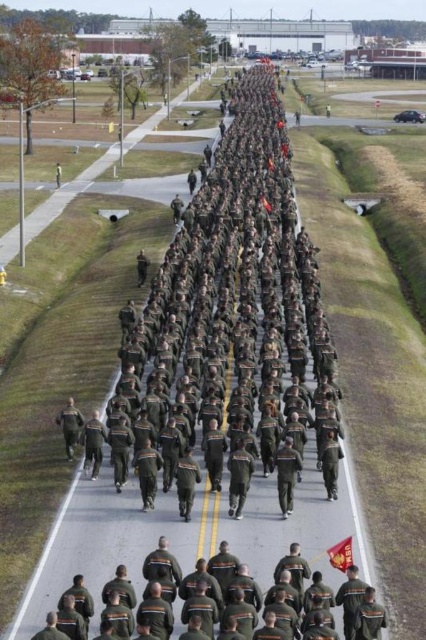
Question: Does dark green uniform at lower right appear on the right side of red fabric flag at center?

Choices:
 (A) yes
 (B) no

Answer: (B)

Question: Does dark green uniform at lower right appear under red fabric flag at center?

Choices:
 (A) yes
 (B) no

Answer: (A)

Question: Which point is farther from the camera taking this photo?

Choices:
 (A) (336, 564)
 (B) (198, 586)

Answer: (A)

Question: Which of the following is the farthest from the observer?

Choices:
 (A) (340, 566)
 (B) (368, 632)

Answer: (A)

Question: Can you confirm if dark green uniform at lower right is smaller than red fabric flag at center?

Choices:
 (A) no
 (B) yes

Answer: (A)

Question: Among these objects, which one is farthest from the camera?

Choices:
 (A) red fabric flag at center
 (B) dark green uniform at lower right

Answer: (A)